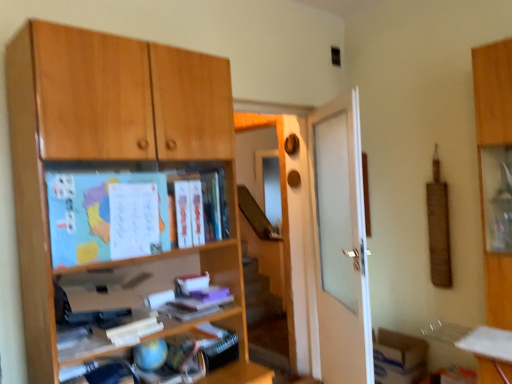
Question: In which direction should I rotate to look at white matte book at center, the second book positioned from the top?

Choices:
 (A) left
 (B) right

Answer: (A)

Question: From a real-world perspective, is blue matte map at upper left located higher than transparent glass screen door at center?

Choices:
 (A) no
 (B) yes

Answer: (B)

Question: Does blue matte map at upper left appear on the left side of transparent glass screen door at center?

Choices:
 (A) yes
 (B) no

Answer: (A)

Question: Does blue matte map at upper left contain transparent glass screen door at center?

Choices:
 (A) yes
 (B) no

Answer: (B)

Question: From the image's perspective, does blue matte map at upper left appear lower than transparent glass screen door at center?

Choices:
 (A) yes
 (B) no

Answer: (B)

Question: Would you say blue matte map at upper left is outside transparent glass screen door at center?

Choices:
 (A) yes
 (B) no

Answer: (A)

Question: Would you say blue matte map at upper left is a long distance from transparent glass screen door at center?

Choices:
 (A) no
 (B) yes

Answer: (B)

Question: Is blue matte map at upper left not inside matte paper book at center, which appears as the second book when ordered from the bottom?

Choices:
 (A) no
 (B) yes

Answer: (B)

Question: From a real-world perspective, is blue matte map at upper left under matte paper book at center, the first book in the top-to-bottom sequence?

Choices:
 (A) no
 (B) yes

Answer: (B)

Question: From the image's perspective, would you say blue matte map at upper left is positioned over matte paper book at center, the first book in the top-to-bottom sequence?

Choices:
 (A) no
 (B) yes

Answer: (A)

Question: Can you confirm if blue matte map at upper left is positioned to the left of matte paper book at center, the first book in the top-to-bottom sequence?

Choices:
 (A) yes
 (B) no

Answer: (A)

Question: Does blue matte map at upper left have a smaller size compared to matte paper book at center, the first book in the top-to-bottom sequence?

Choices:
 (A) no
 (B) yes

Answer: (A)

Question: Considering the relative sizes of blue matte map at upper left and matte paper book at center, which appears as the second book when ordered from the bottom, in the image provided, is blue matte map at upper left bigger than matte paper book at center, which appears as the second book when ordered from the bottom,?

Choices:
 (A) no
 (B) yes

Answer: (B)